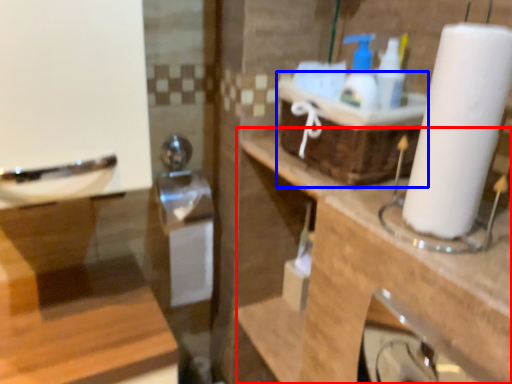
Question: Which of the following is the farthest to the observer, counter top (highlighted by a red box) or basket (highlighted by a blue box)?

Choices:
 (A) counter top
 (B) basket

Answer: (B)